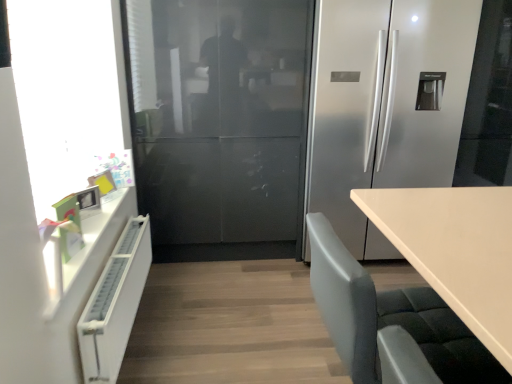
Question: Is point (53, 77) closer or farther from the camera than point (414, 109)?

Choices:
 (A) farther
 (B) closer

Answer: (B)

Question: In terms of width, does transparent glass window screen at left look wider or thinner when compared to satin silver refrigerator at center?

Choices:
 (A) thin
 (B) wide

Answer: (A)

Question: Which of these objects is positioned farthest from the transparent glass window screen at left?

Choices:
 (A) white matte radiator at left
 (B) gray fabric chair at lower right
 (C) satin silver refrigerator at center

Answer: (C)

Question: Which object is positioned closest to the transparent glass window screen at left?

Choices:
 (A) gray fabric chair at lower right
 (B) satin silver refrigerator at center
 (C) white matte radiator at left

Answer: (C)